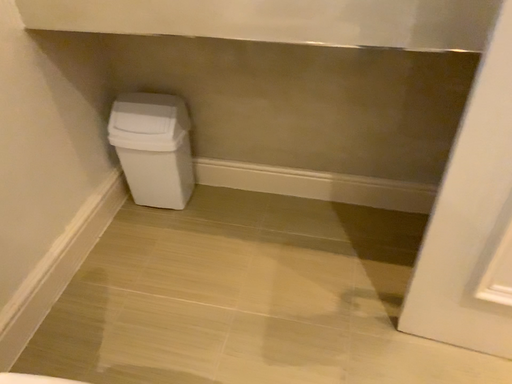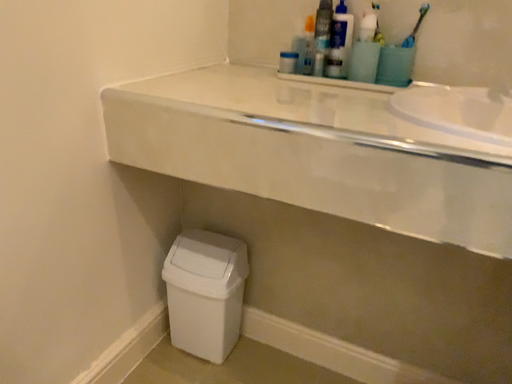
Question: Which way did the camera rotate in the video?

Choices:
 (A) rotated right
 (B) rotated left

Answer: (B)